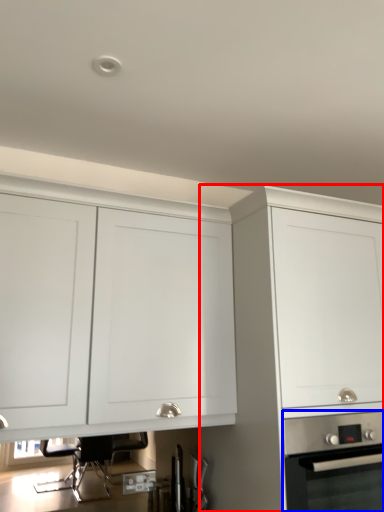
Question: Among these objects, which one is farthest to the camera, cabinetry (highlighted by a red box) or home appliance (highlighted by a blue box)?

Choices:
 (A) cabinetry
 (B) home appliance

Answer: (B)